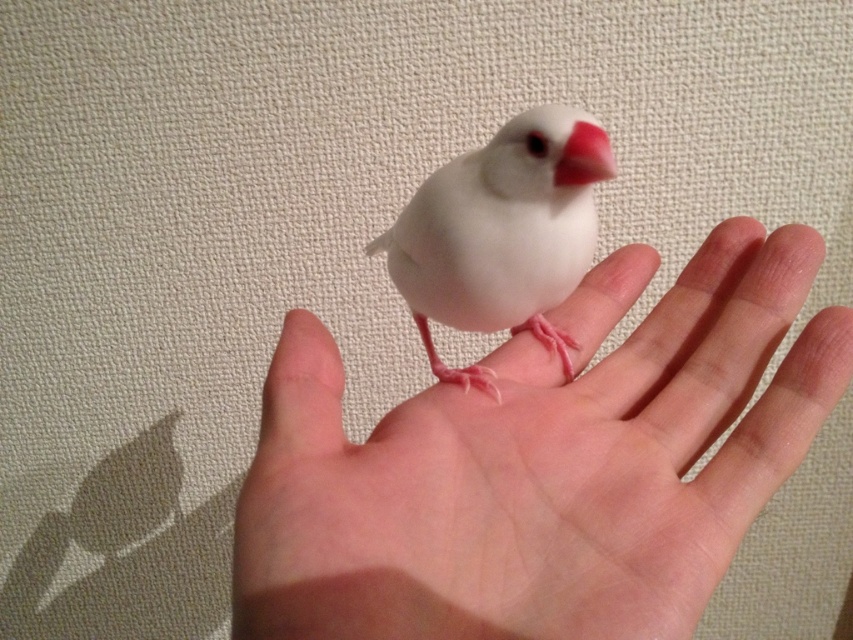
Does white matte bird at center have a lesser width compared to matte pink beak at center?

No, white matte bird at center is not thinner than matte pink beak at center.

Who is shorter, white matte bird at center or matte pink beak at center?

matte pink beak at center

Does point (485, 266) lie in front of point (579, 172)?

No, (485, 266) is further to viewer.

The image size is (853, 640). I want to click on white matte bird at center, so click(x=502, y=234).

Which of these two, smooth skin palm at center or white matte bird at center, stands shorter?

white matte bird at center

Where is `smooth skin palm at center`? smooth skin palm at center is located at coordinates (540, 468).

Does smooth skin palm at center appear over matte pink beak at center?

No.

This screenshot has width=853, height=640. What do you see at coordinates (540, 468) in the screenshot?
I see `smooth skin palm at center` at bounding box center [540, 468].

Between point (462, 493) and point (572, 172), which one is positioned in front?

Point (462, 493) is more forward.

Image resolution: width=853 pixels, height=640 pixels. Identify the location of smooth skin palm at center. (540, 468).